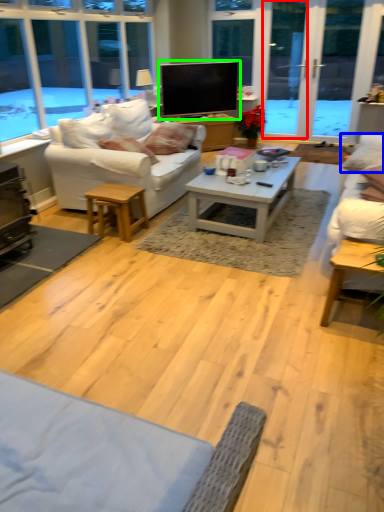
Question: Estimate the real-world distances between objects in this image. Which object is farther from screen door (highlighted by a red box), pillow (highlighted by a blue box) or television (highlighted by a green box)?

Choices:
 (A) pillow
 (B) television

Answer: (A)